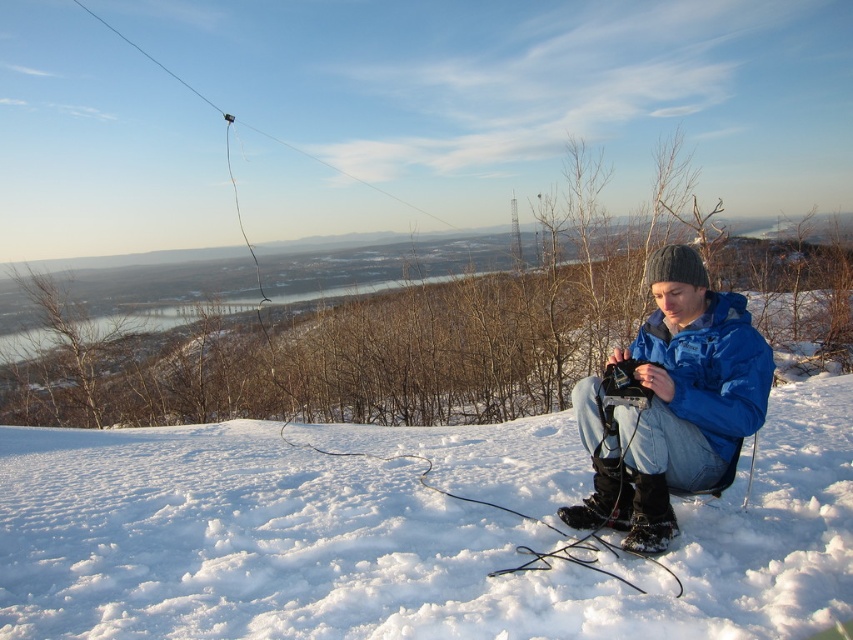
Which is in front, point (701, 342) or point (689, 323)?

Point (701, 342) is more forward.

Is blue matte jacket at center positioned in front of blue synthetic jacket at center?

No, it is behind blue synthetic jacket at center.

Who is more distant from viewer, (659, 497) or (706, 403)?

The point (659, 497) is more distant.

Image resolution: width=853 pixels, height=640 pixels. In order to click on blue matte jacket at center in this screenshot , I will do `click(670, 404)`.

Can you confirm if white fluffy snow at center is positioned above blue matte jacket at center?

Actually, white fluffy snow at center is below blue matte jacket at center.

From the picture: Can you confirm if white fluffy snow at center is shorter than blue matte jacket at center?

Yes, white fluffy snow at center is shorter than blue matte jacket at center.

Locate an element on the screen. The image size is (853, 640). white fluffy snow at center is located at coordinates (397, 541).

Who is more forward, (850,563) or (693,321)?

Point (850,563) is more forward.

This screenshot has height=640, width=853. What do you see at coordinates (397, 541) in the screenshot? I see `white fluffy snow at center` at bounding box center [397, 541].

I want to click on white fluffy snow at center, so click(x=397, y=541).